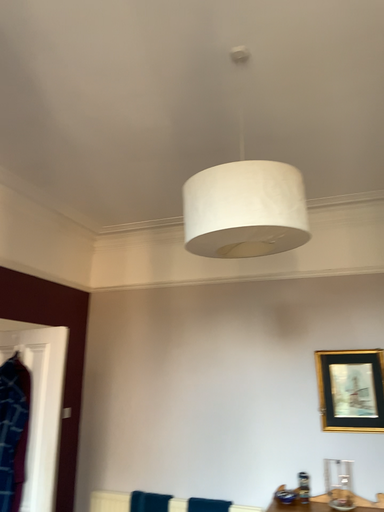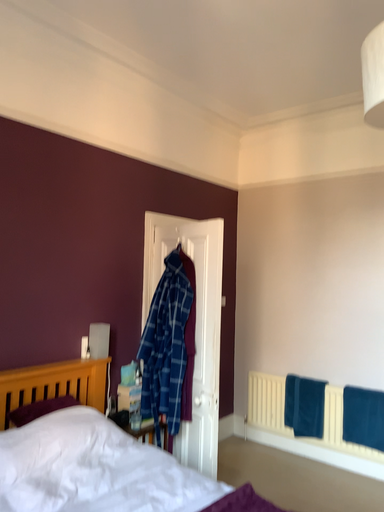
Question: How did the camera likely rotate when shooting the video?

Choices:
 (A) rotated left
 (B) rotated right

Answer: (A)